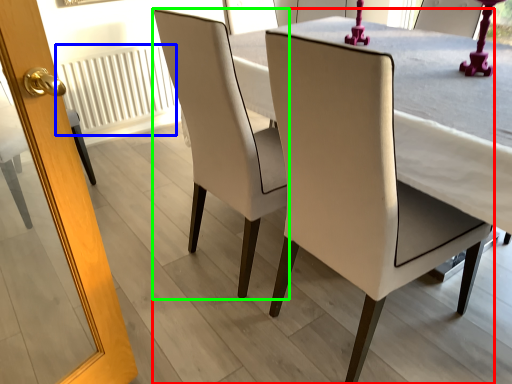
Question: Which object is positioned closest to chair (highlighted by a red box)? Select from radiator (highlighted by a blue box) and chair (highlighted by a green box).

Choices:
 (A) radiator
 (B) chair

Answer: (B)